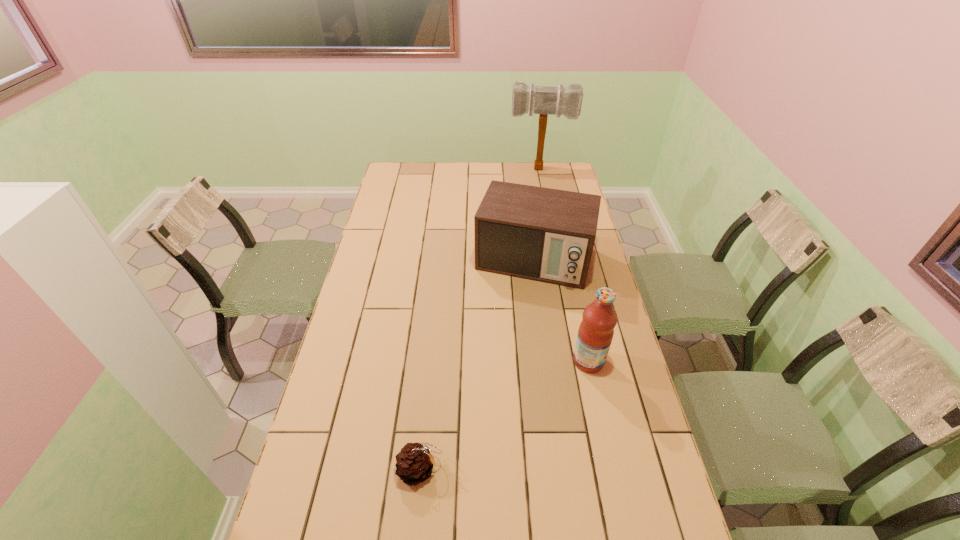
Identify the location of pinecone. The width and height of the screenshot is (960, 540). (414, 463).

Image resolution: width=960 pixels, height=540 pixels. Identify the location of the nearest object. (414, 463).

Find the location of `the third shortest object`. the third shortest object is located at coordinates (596, 330).

The width and height of the screenshot is (960, 540). What are the coordinates of `the second nearest object` in the screenshot? It's located at (596, 330).

Locate an element on the screen. Image resolution: width=960 pixels, height=540 pixels. the tallest object is located at coordinates (542, 100).

At what (x,y) coordinates should I click in order to perform the action: click on mallet. Please return your answer as a coordinate pair (x, y). This screenshot has height=540, width=960. Looking at the image, I should click on (542, 100).

At what (x,y) coordinates should I click in order to perform the action: click on the third tallest object. Please return your answer as a coordinate pair (x, y). Looking at the image, I should click on (543, 234).

Where is `the third nearest object`? The height and width of the screenshot is (540, 960). the third nearest object is located at coordinates (543, 234).

Where is `free region located with a leaf charm attached to the pinecone`? The height and width of the screenshot is (540, 960). free region located with a leaf charm attached to the pinecone is located at coordinates (518, 469).

Locate an element on the screen. vacant point located on the front label of the third shortest object is located at coordinates (620, 361).